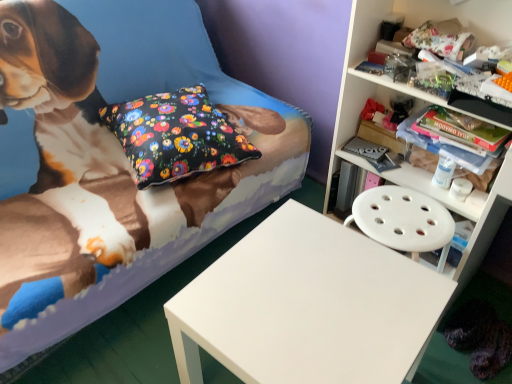
At what (x,y) coordinates should I click in order to perform the action: click on fluffy fabric bed at center. Please return your answer as a coordinate pair (x, y). The height and width of the screenshot is (384, 512). Looking at the image, I should click on (113, 163).

Describe the element at coordinates (113, 163) in the screenshot. The height and width of the screenshot is (384, 512). I see `fluffy fabric bed at center` at that location.

Where is `white plastic shelf at upper right`? The height and width of the screenshot is (384, 512). white plastic shelf at upper right is located at coordinates (411, 27).

Where is `fluffy fabric bed at center`? fluffy fabric bed at center is located at coordinates (113, 163).

How different are the orientations of fluffy fabric bed at center and white matte table at center in degrees?

The facing directions of fluffy fabric bed at center and white matte table at center are 180 degrees apart.

From the image's perspective, which object appears higher, fluffy fabric bed at center or white matte table at center?

fluffy fabric bed at center, from the image's perspective.

Considering the sizes of objects fluffy fabric bed at center and white matte table at center in the image provided, who is shorter, fluffy fabric bed at center or white matte table at center?

With less height is white matte table at center.

Considering the relative sizes of fluffy fabric bed at center and white matte table at center in the image provided, is fluffy fabric bed at center smaller than white matte table at center?

Actually, fluffy fabric bed at center might be larger than white matte table at center.

How different are the orientations of fluffy fabric bed at center and white plastic shelf at upper right in degrees?

They differ by 95 degrees in their facing directions.

Between fluffy fabric bed at center and white plastic shelf at upper right, which one has more height?

Standing taller between the two is white plastic shelf at upper right.

Is fluffy fabric bed at center positioned in front of white plastic shelf at upper right?

Yes, the depth of fluffy fabric bed at center is less than that of white plastic shelf at upper right.

Can you tell me how much white plastic shelf at upper right and floral fabric pillow at center differ in facing direction?

The angle between the facing direction of white plastic shelf at upper right and the facing direction of floral fabric pillow at center is 74.9 degrees.

Looking at this image, is white plastic shelf at upper right wider or thinner than floral fabric pillow at center?

white plastic shelf at upper right is thinner than floral fabric pillow at center.

How far apart are white plastic shelf at upper right and floral fabric pillow at center?

24.18 inches.

From a real-world perspective, between white plastic shelf at upper right and floral fabric pillow at center, who is vertically lower?

In real-world perspective, floral fabric pillow at center is lower.

Considering the relative sizes of floral fabric pillow at center and white matte table at center in the image provided, is floral fabric pillow at center taller than white matte table at center?

No.

From a real-world perspective, which object rests below the other?

In real-world perspective, white matte table at center is lower.

Can you tell me how much floral fabric pillow at center and white matte table at center differ in facing direction?

There is a 159-degree angle between the facing directions of floral fabric pillow at center and white matte table at center.

Looking at this image, is floral fabric pillow at center turned away from white matte table at center?

No, white matte table at center is not at the back of floral fabric pillow at center.

Would you say floral fabric pillow at center is outside fluffy fabric bed at center?

Actually, floral fabric pillow at center is at least partially inside fluffy fabric bed at center.

Consider the image. From a real-world perspective, is floral fabric pillow at center below fluffy fabric bed at center?

No, from a real-world perspective, floral fabric pillow at center is not beneath fluffy fabric bed at center.

Considering the positions of points (182, 175) and (2, 284), is point (182, 175) farther from camera compared to point (2, 284)?

Yes.

Is white plastic shelf at upper right next to white matte table at center and touching it?

white plastic shelf at upper right and white matte table at center are clearly separated.

How different are the orientations of white plastic shelf at upper right and white matte table at center in degrees?

The facing directions of white plastic shelf at upper right and white matte table at center are 84.6 degrees apart.

In terms of size, does white plastic shelf at upper right appear bigger or smaller than white matte table at center?

In the image, white plastic shelf at upper right appears to be larger than white matte table at center.

From the image's perspective, is white plastic shelf at upper right positioned above or below white matte table at center?

white plastic shelf at upper right is situated higher than white matte table at center in the image.

Is fluffy fabric bed at center far from floral fabric pillow at center?

They are positioned close to each other.

Considering the positions of objects fluffy fabric bed at center and floral fabric pillow at center in the image provided, who is more to the right, fluffy fabric bed at center or floral fabric pillow at center?

Positioned to the right is floral fabric pillow at center.

Considering the relative sizes of fluffy fabric bed at center and floral fabric pillow at center in the image provided, is fluffy fabric bed at center taller than floral fabric pillow at center?

Yes.

The image size is (512, 384). In order to click on bed on the left of floral fabric pillow at center in this screenshot , I will do `click(113, 163)`.

The height and width of the screenshot is (384, 512). Find the location of `bed located in front of the white matte table at center`. bed located in front of the white matte table at center is located at coordinates (113, 163).

Where is `shelf below the fluffy fabric bed at center (from the image's perspective)`? shelf below the fluffy fabric bed at center (from the image's perspective) is located at coordinates (411, 27).

Which object lies further to the anchor point white matte table at center, fluffy fabric bed at center or white plastic shelf at upper right?

white plastic shelf at upper right is positioned further to the anchor white matte table at center.

Which object lies nearer to the anchor point white plastic shelf at upper right, floral fabric pillow at center or fluffy fabric bed at center?

Among the two, floral fabric pillow at center is located nearer to white plastic shelf at upper right.

Considering their positions, is floral fabric pillow at center positioned further to fluffy fabric bed at center than white plastic shelf at upper right?

white plastic shelf at upper right.

Based on their spatial positions, is fluffy fabric bed at center or white matte table at center closer to white plastic shelf at upper right?

white matte table at center lies closer to white plastic shelf at upper right than the other object.

Looking at the image, which one is located further to fluffy fabric bed at center, white plastic shelf at upper right or white matte table at center?

Answer: white plastic shelf at upper right lies further to fluffy fabric bed at center than the other object.

Considering their positions, is white plastic shelf at upper right positioned closer to floral fabric pillow at center than white matte table at center?

The object closer to floral fabric pillow at center is white matte table at center.

When comparing their distances from floral fabric pillow at center, does white matte table at center or white plastic shelf at upper right seem further?

Based on the image, white plastic shelf at upper right appears to be further to floral fabric pillow at center.

Estimate the real-world distances between objects in this image. Which object is further from fluffy fabric bed at center, white matte table at center or floral fabric pillow at center?

The object further to fluffy fabric bed at center is white matte table at center.

This screenshot has width=512, height=384. I want to click on table situated between floral fabric pillow at center and white plastic shelf at upper right from left to right, so [x=307, y=306].

Find the location of a particular element. bed between floral fabric pillow at center and white matte table at center from top to bottom is located at coordinates [x=113, y=163].

Locate an element on the screen. The height and width of the screenshot is (384, 512). pillow situated between fluffy fabric bed at center and white plastic shelf at upper right from left to right is located at coordinates (175, 135).

This screenshot has width=512, height=384. In order to click on table between fluffy fabric bed at center and white plastic shelf at upper right in this screenshot , I will do `click(307, 306)`.